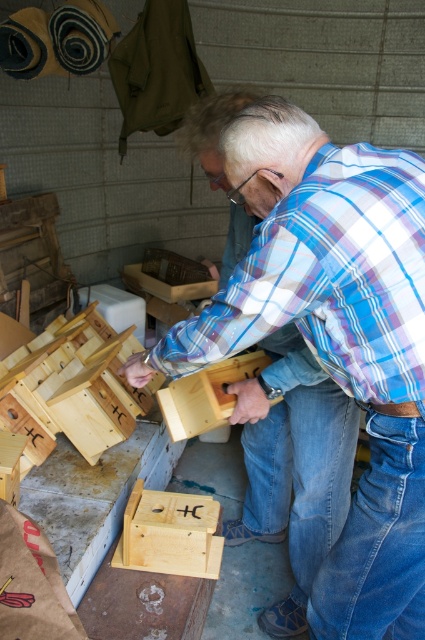
Can you confirm if blue denim jeans at lower right is smaller than blue denim jeans at lower center?

Yes.

From the picture: Who is shorter, blue denim jeans at lower right or blue denim jeans at lower center?

Standing shorter between the two is blue denim jeans at lower right.

Which is in front, point (404, 433) or point (269, 436)?

Positioned in front is point (404, 433).

I want to click on blue denim jeans at lower right, so click(x=377, y=545).